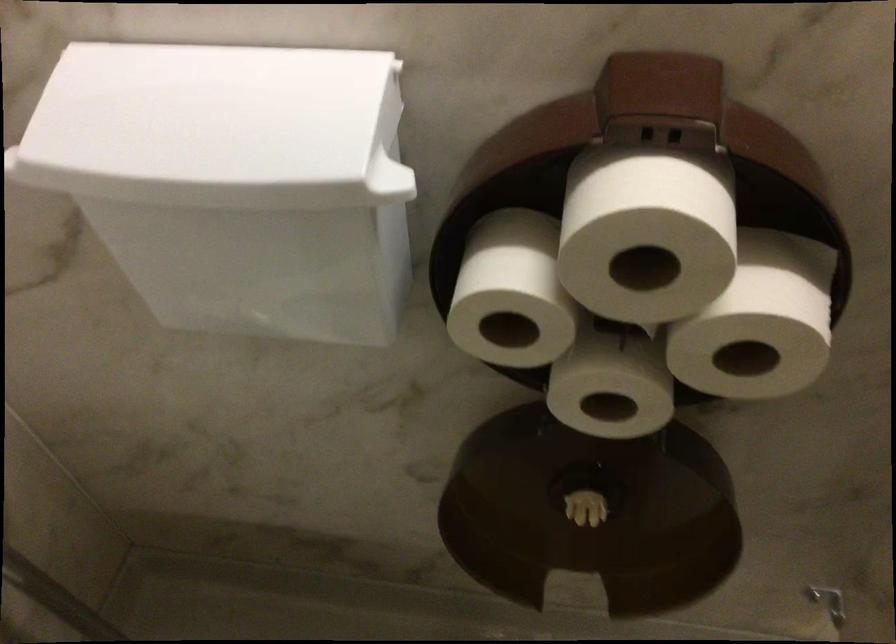
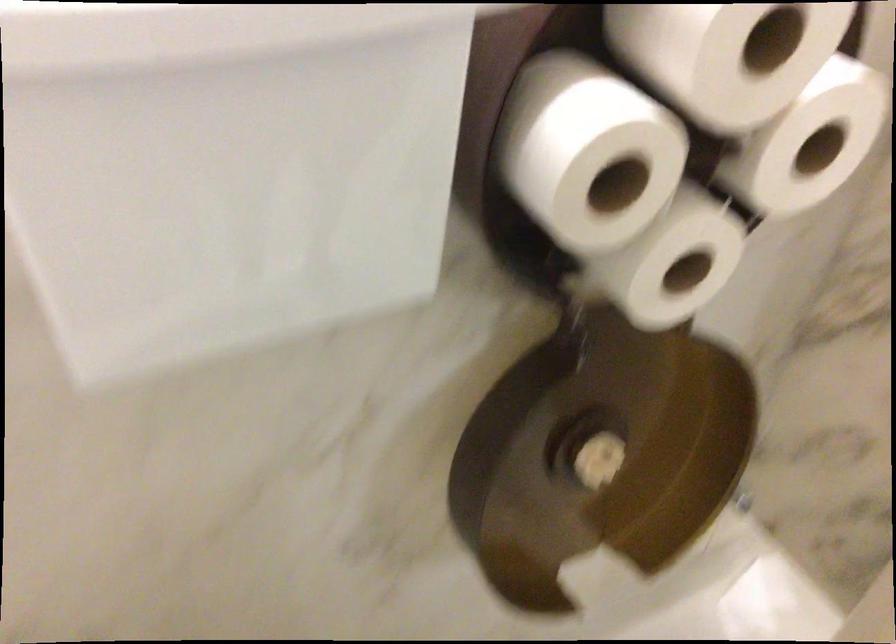
In the second image, find the point that corresponds to (x=475, y=298) in the first image.

(584, 151)